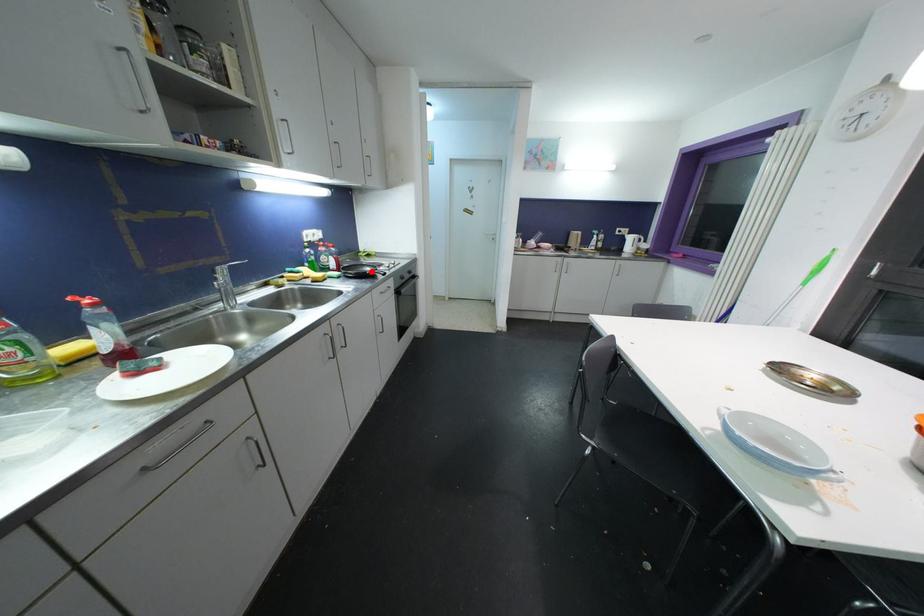
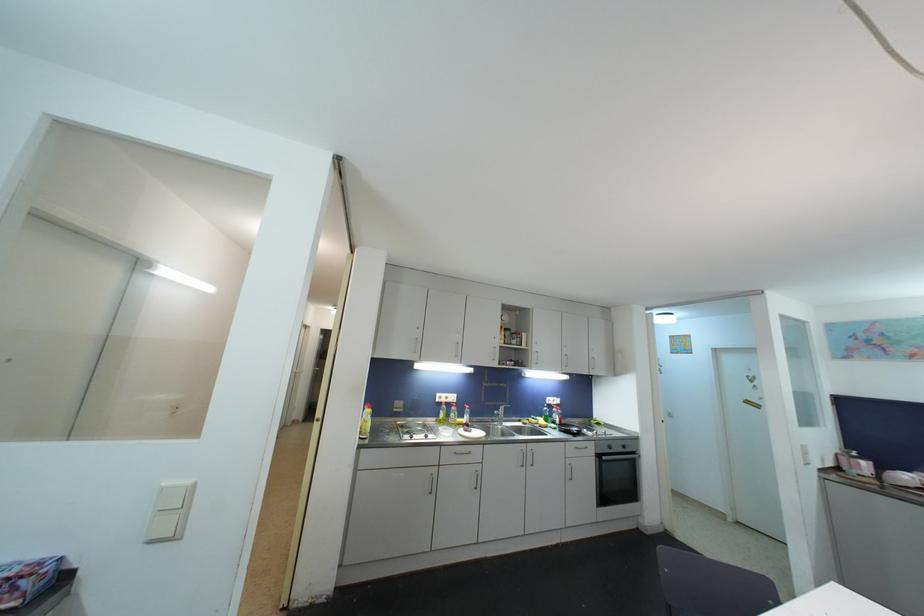
Where in the second image is the point corresponding to the highlighted location from the first image?

(578, 432)